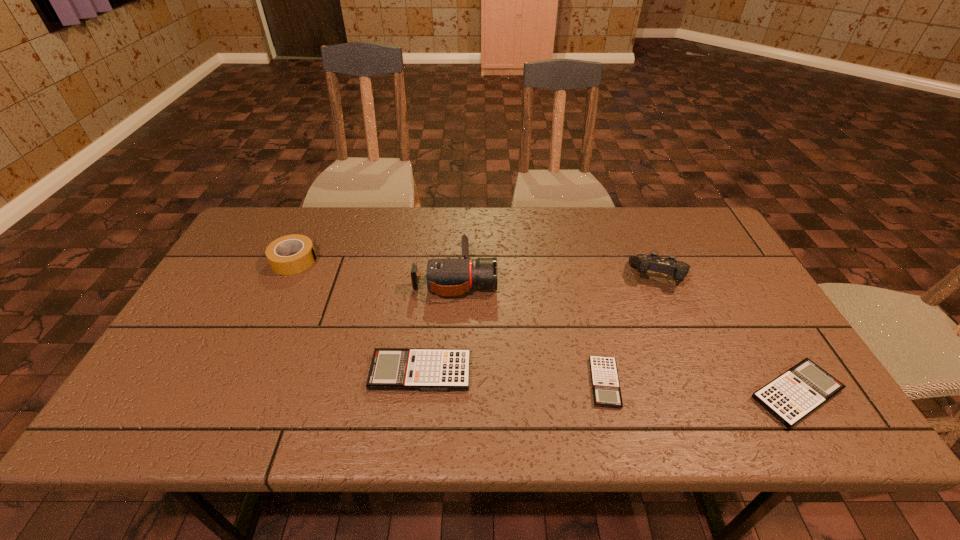
The height and width of the screenshot is (540, 960). Find the location of `vacant space that satisfies the following two spatial constraints: 1. on the back side of the control; 2. on the right side of the fourth object from left to right`. vacant space that satisfies the following two spatial constraints: 1. on the back side of the control; 2. on the right side of the fourth object from left to right is located at coordinates (579, 276).

Find the location of a particular element. The width and height of the screenshot is (960, 540). free spot that satisfies the following two spatial constraints: 1. at the edge of the leftmost calculator; 2. on the left side of the fourth shortest object is located at coordinates (243, 372).

Locate an element on the screen. The width and height of the screenshot is (960, 540). free location that satisfies the following two spatial constraints: 1. at the edge of the duct tape; 2. on the left side of the shortest object is located at coordinates (238, 383).

I want to click on free point that satisfies the following two spatial constraints: 1. on the lens of the tallest object; 2. on the left side of the fourth object from left to right, so click(x=449, y=383).

What are the coordinates of `vacant region that satisfies the following two spatial constraints: 1. at the edge of the second shortest object; 2. on the left side of the fourth shortest object` in the screenshot? It's located at (233, 394).

Locate an element on the screen. The image size is (960, 540). vacant space that satisfies the following two spatial constraints: 1. at the edge of the leftmost object; 2. on the left side of the shortest calculator is located at coordinates coord(238,383).